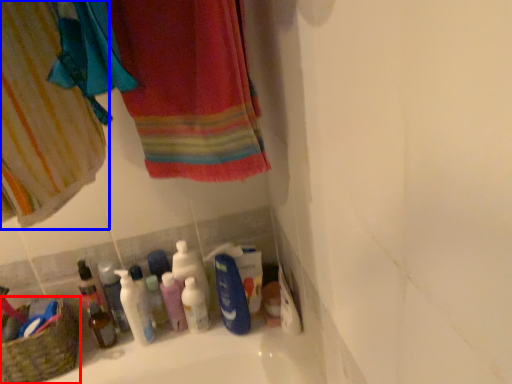
Question: Which object is closer to the camera taking this photo, basket (highlighted by a red box) or curtain (highlighted by a blue box)?

Choices:
 (A) basket
 (B) curtain

Answer: (B)